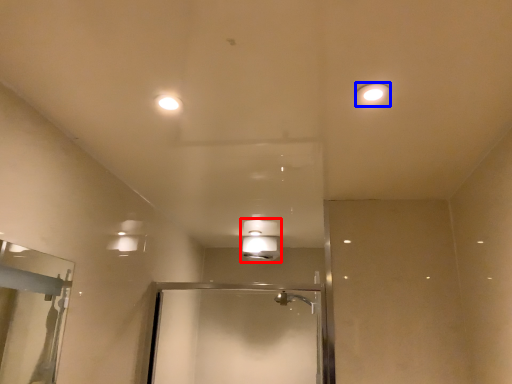
Question: Which of the following is the farthest to the observer, light fixture (highlighted by a red box) or light fixture (highlighted by a blue box)?

Choices:
 (A) light fixture
 (B) light fixture

Answer: (A)